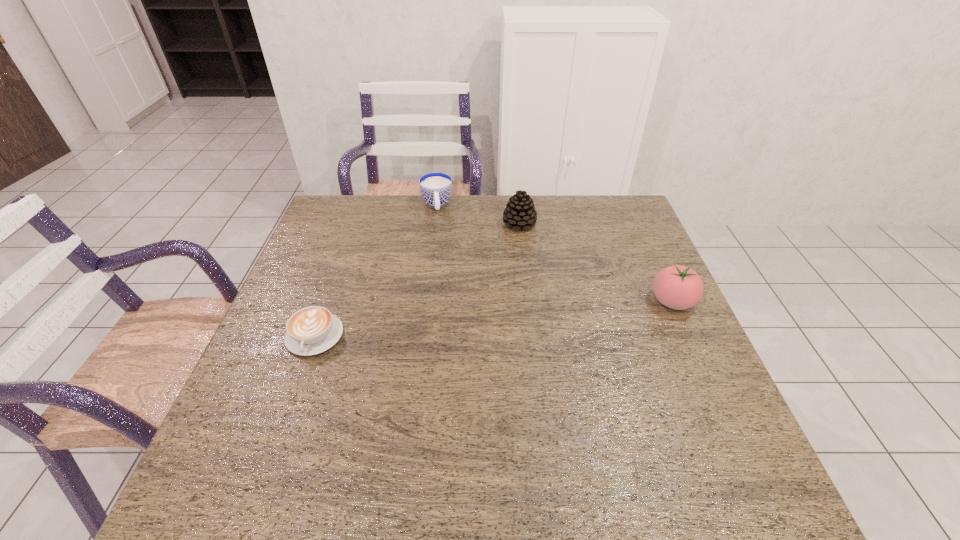
The height and width of the screenshot is (540, 960). Find the location of `vacant space situated 0.320m at the narrow end of the third object from left to right`. vacant space situated 0.320m at the narrow end of the third object from left to right is located at coordinates (492, 303).

This screenshot has height=540, width=960. What are the coordinates of `vacant position located on the side of the third tallest object with the handle` in the screenshot? It's located at click(x=441, y=251).

This screenshot has height=540, width=960. Identify the location of vacant space located on the side of the third tallest object with the handle. (439, 233).

This screenshot has width=960, height=540. In order to click on vacant space located 0.090m on the side of the third tallest object with the handle in this screenshot , I will do `click(439, 233)`.

Where is `pinecone located at the far edge`? pinecone located at the far edge is located at coordinates (520, 212).

At what (x,y) coordinates should I click in order to perform the action: click on cup located in the far edge section of the desktop. Please return your answer as a coordinate pair (x, y). Looking at the image, I should click on (435, 187).

I want to click on object that is at the left edge, so 312,330.

This screenshot has height=540, width=960. Find the location of `object located at the right edge`. object located at the right edge is located at coordinates (678, 287).

The width and height of the screenshot is (960, 540). I want to click on vacant space at the far edge of the desktop, so click(499, 215).

At what (x,y) coordinates should I click in order to perform the action: click on vacant space at the near edge. Please return your answer as a coordinate pair (x, y). The height and width of the screenshot is (540, 960). Looking at the image, I should click on (633, 442).